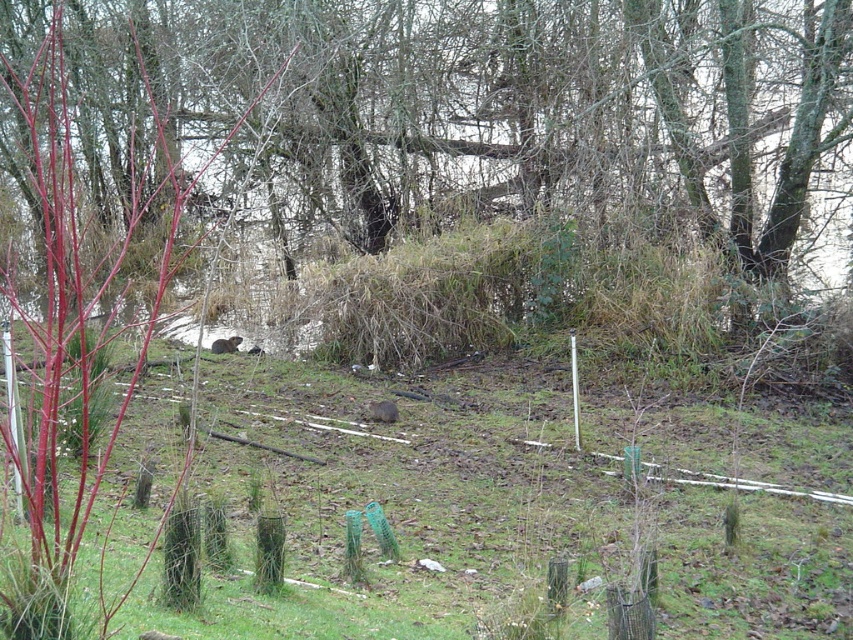
Question: Which point is closer to the camera?

Choices:
 (A) green grassy at center
 (B) brown grass at center

Answer: (B)

Question: Observing the image, what is the correct spatial positioning of green grassy at center in reference to brown furry rodent at center?

Choices:
 (A) right
 (B) left

Answer: (A)

Question: Is brown grass at center positioned at the back of brown furry rodent at center?

Choices:
 (A) yes
 (B) no

Answer: (B)

Question: Which object appears closest to the camera in this image?

Choices:
 (A) brown furry animal at center
 (B) green grassy at center
 (C) brown grass at center
 (D) brown furry rodent at center

Answer: (C)

Question: Does green grassy at center appear over brown furry rodent at center?

Choices:
 (A) no
 (B) yes

Answer: (B)

Question: Based on their relative distances, which object is nearer to the brown grass at center?

Choices:
 (A) green grassy at center
 (B) brown furry animal at center
 (C) brown furry rodent at center

Answer: (A)